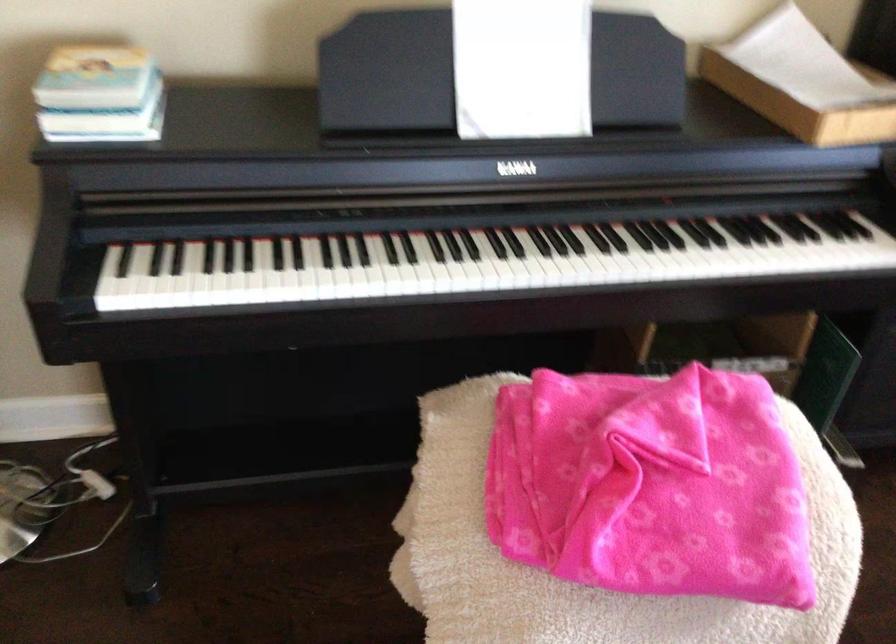
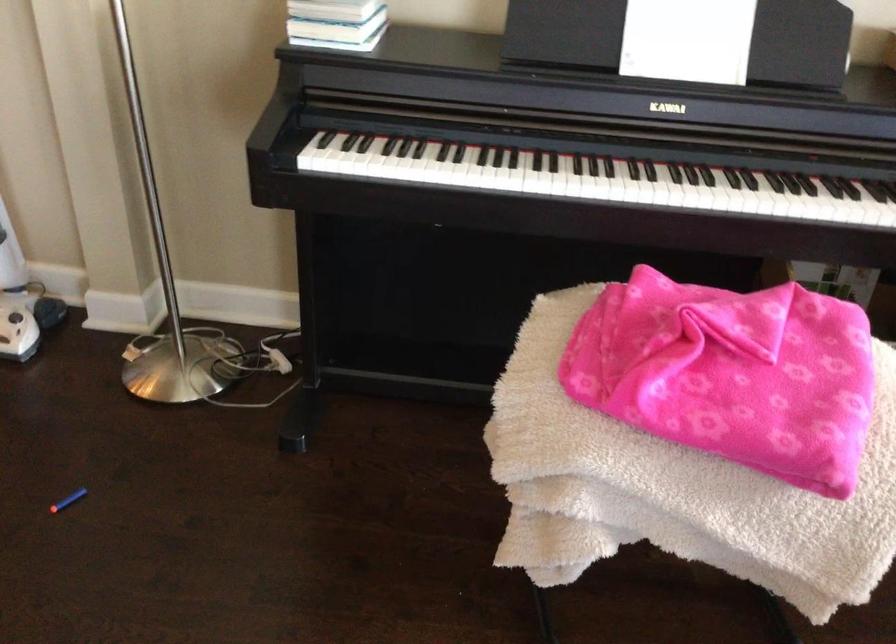
Question: The images are taken continuously from a first-person perspective. In which direction is your viewpoint rotating?

Choices:
 (A) Left
 (B) Right
 (C) Up
 (D) Down

Answer: (A)